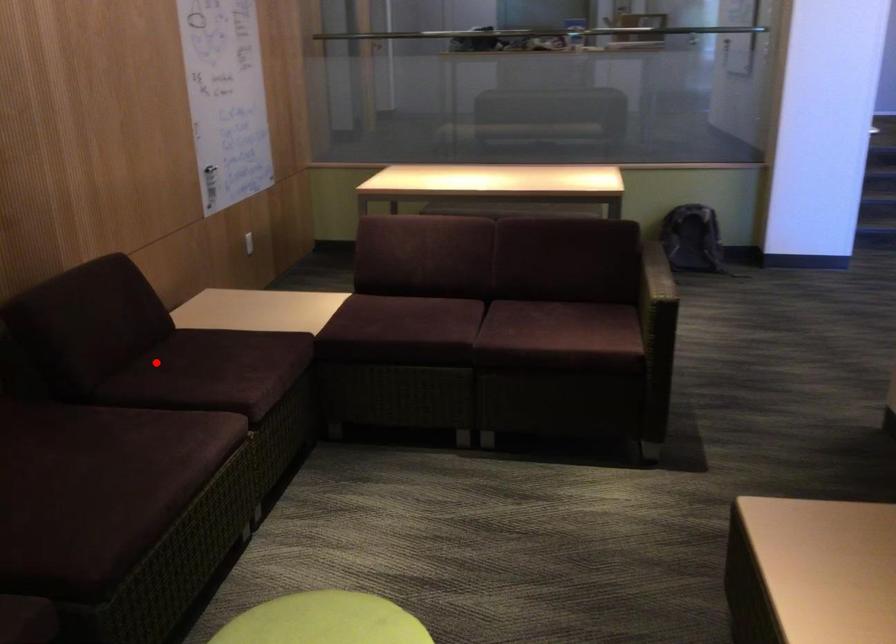
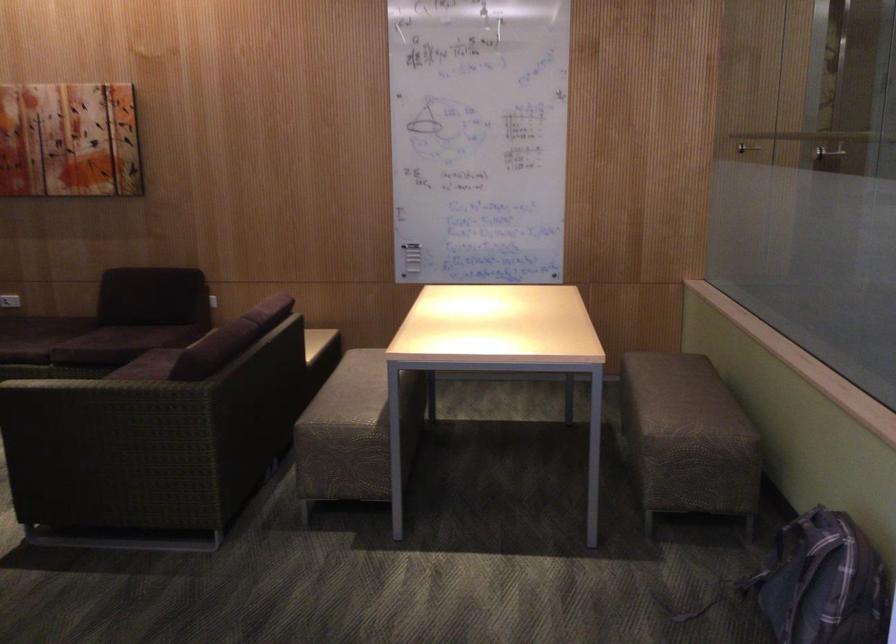
Question: I am providing you with two images of the same scene from different viewpoints. A red point is shown in image1. For the corresponding object point in image2, is it positioned nearer or farther from the camera?

Choices:
 (A) Nearer
 (B) Farther

Answer: (B)